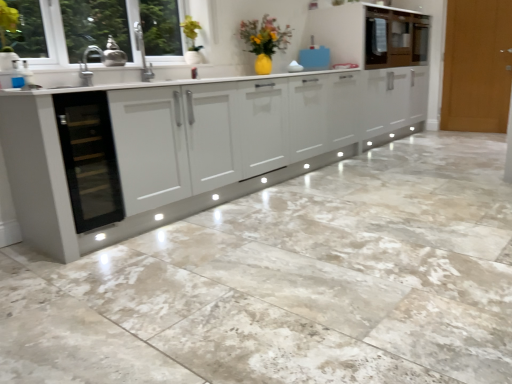
Question: From the image's perspective, is light brown wooden door at right above or below glossy white cabinet at upper right, which ranks as the 1th cabinetry in right-to-left order?

Choices:
 (A) below
 (B) above

Answer: (A)

Question: Is light brown wooden door at right to the left or to the right of glossy white cabinet at upper right, which is the second cabinetry in left-to-right order, in the image?

Choices:
 (A) right
 (B) left

Answer: (A)

Question: Estimate the real-world distances between objects in this image. Which object is closer to the transparent glass wine cooler at left?

Choices:
 (A) light brown wooden door at right
 (B) clear glass window at upper left
 (C) blue plastic bag at upper center, positioned as the first appliance in right-to-left order
 (D) glossy white cabinet at upper right, which ranks as the 1th cabinetry in right-to-left order
 (E) metallic brass teapot at upper left, which is the first appliance in left-to-right order

Answer: (B)

Question: Which is farther from the clear glass window at upper left?

Choices:
 (A) blue plastic bag at upper center, positioned as the first appliance in right-to-left order
 (B) glossy white cabinet at upper center, which is the first cabinetry from left to right
 (C) light brown wooden door at right
 (D) glossy white cabinet at upper right, which is the second cabinetry in left-to-right order
 (E) metallic brass teapot at upper left, which is the first appliance in left-to-right order

Answer: (C)